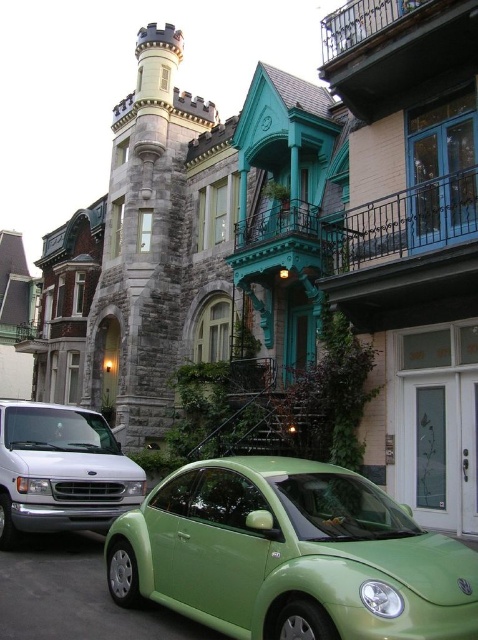
Question: Where is green matte car at lower center located in relation to silver metallic van at lower left in the image?

Choices:
 (A) below
 (B) above

Answer: (A)

Question: Among these points, which one is nearest to the camera?

Choices:
 (A) (133, 481)
 (B) (470, 608)

Answer: (B)

Question: Does green matte car at lower center have a larger size compared to silver metallic van at lower left?

Choices:
 (A) no
 (B) yes

Answer: (B)

Question: Can you confirm if green matte car at lower center is positioned below silver metallic van at lower left?

Choices:
 (A) yes
 (B) no

Answer: (A)